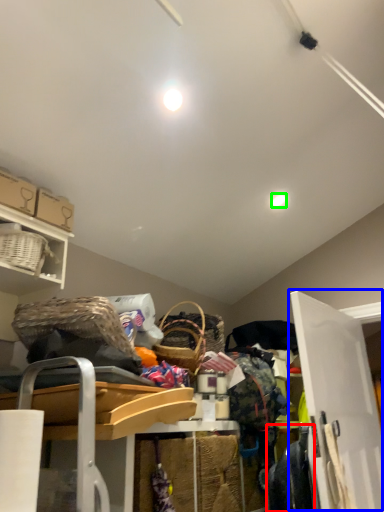
Question: Based on their relative distances, which object is farther from clothing (highlighted by a red box)? Choose from door (highlighted by a blue box) and light (highlighted by a green box).

Choices:
 (A) door
 (B) light

Answer: (B)